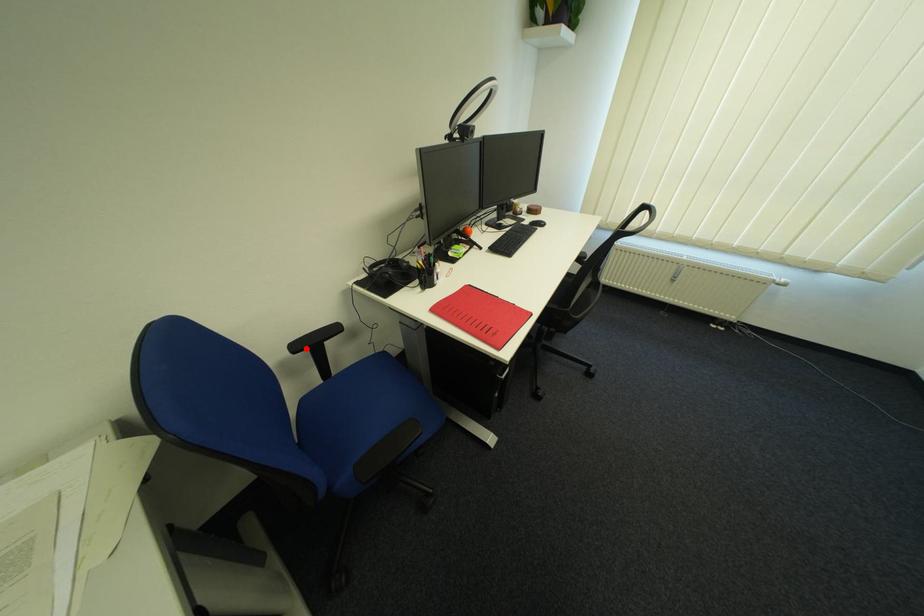
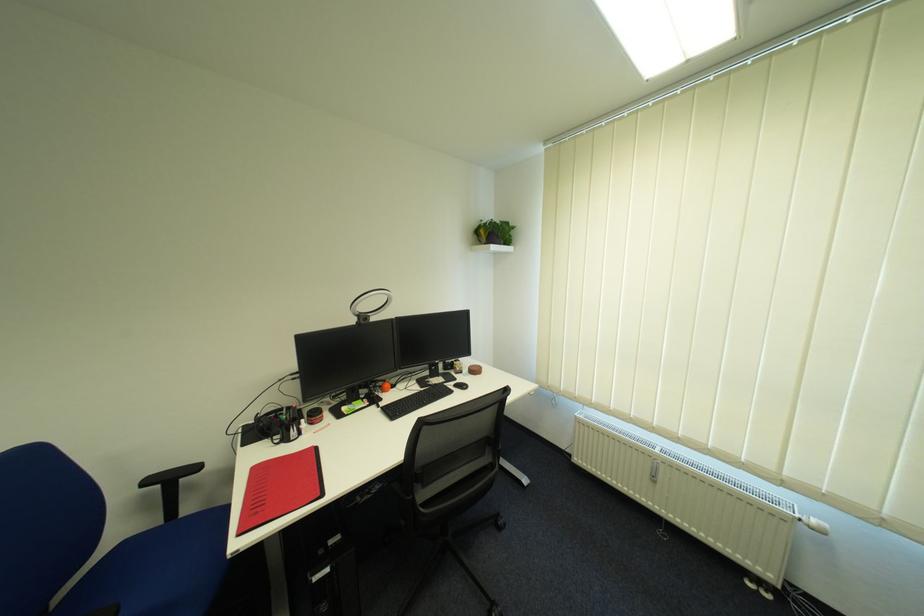
Where in the second image is the point corresponding to the highlighted location from the first image?

(157, 483)